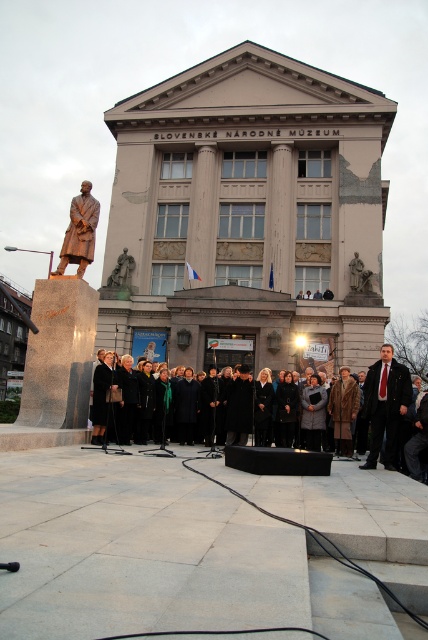
Question: Does dark suit at center have a smaller size compared to bronze statue at left?

Choices:
 (A) no
 (B) yes

Answer: (A)

Question: Which object appears closest to the camera in this image?

Choices:
 (A) dark suit at center
 (B) bronze statue at center

Answer: (A)

Question: In this image, where is dark suit at center located relative to bronze statue at center?

Choices:
 (A) above
 (B) below

Answer: (B)

Question: Which point is closer to the camera taking this photo?

Choices:
 (A) (397, 376)
 (B) (124, 266)
 (C) (83, 211)

Answer: (A)

Question: Does dark suit at center appear on the left side of bronze statue at center?

Choices:
 (A) yes
 (B) no

Answer: (B)

Question: Which point appears closest to the camera in this image?

Choices:
 (A) (371, 452)
 (B) (80, 262)

Answer: (A)